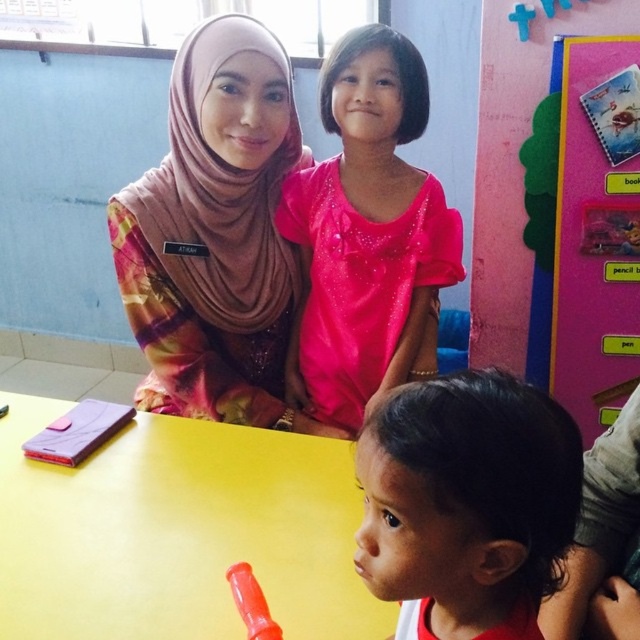
Question: Is dark brown hair at lower right smaller than rubberized plastic toy at lower center?

Choices:
 (A) no
 (B) yes

Answer: (A)

Question: Based on their relative distances, which object is nearer to the pink sparkly dress at center?

Choices:
 (A) rubberized plastic toy at lower center
 (B) yellow matte table at center

Answer: (B)

Question: Estimate the real-world distances between objects in this image. Which object is farther from the pink sparkly dress at center?

Choices:
 (A) multicolored fabric hijab at upper left
 (B) dark brown hair at lower right
 (C) pink paperboard at upper right

Answer: (B)

Question: Is multicolored fabric hijab at upper left thinner than pink paperboard at upper right?

Choices:
 (A) no
 (B) yes

Answer: (A)

Question: Which point is closer to the camera?

Choices:
 (A) (579, 328)
 (B) (179, 627)
 (C) (508, 400)

Answer: (C)

Question: Does dark brown hair at lower right have a lesser width compared to rubberized plastic toy at lower center?

Choices:
 (A) no
 (B) yes

Answer: (A)